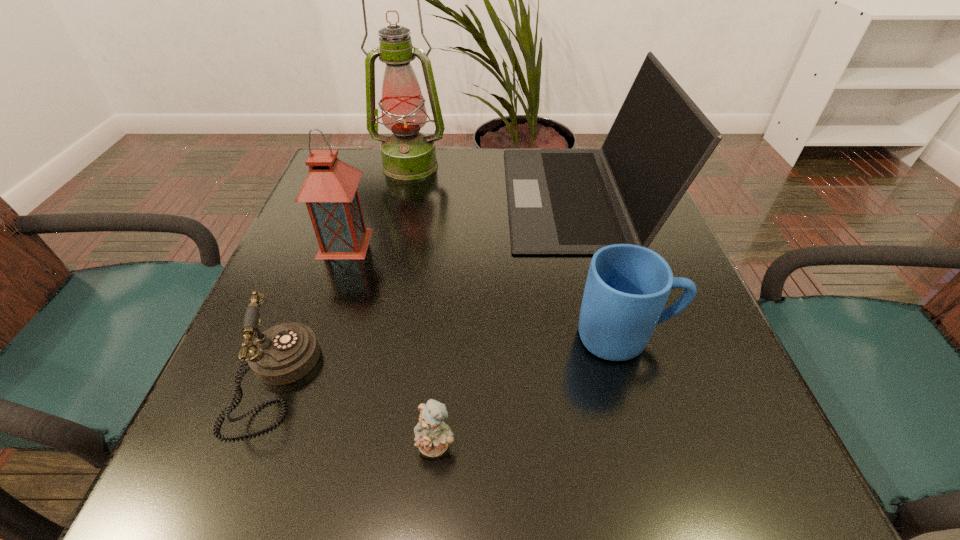
You are a GUI agent. You are given a task and a screenshot of the screen. Output one action in this format:
    pyautogui.click(x=<x>, y=<y>)
    Task: Click on the tallest object
    This screenshot has height=540, width=960.
    Given the screenshot: What is the action you would take?
    pyautogui.click(x=407, y=154)

You are a GUI agent. You are given a task and a screenshot of the screen. Output one action in this format:
    pyautogui.click(x=<x>, y=<y>)
    Task: Click on the laptop
    
    Given the screenshot: What is the action you would take?
    pyautogui.click(x=560, y=201)

Locate an element on the screen. lantern is located at coordinates (330, 192).

Identify the location of the fourth tallest object. The image size is (960, 540). (627, 286).

This screenshot has width=960, height=540. Find the location of `telephone`. telephone is located at coordinates (285, 353).

Locate an element on the screen. The height and width of the screenshot is (540, 960). teddy bear is located at coordinates (432, 435).

Image resolution: width=960 pixels, height=540 pixels. I want to click on vacant space located 0.130m on the right of the oil lamp, so click(x=496, y=165).

Where is `free location located 0.390m on the screen of the laptop`? free location located 0.390m on the screen of the laptop is located at coordinates (344, 196).

What are the coordinates of `blank space located on the screen of the laptop` in the screenshot? It's located at (377, 196).

The height and width of the screenshot is (540, 960). Find the location of `blank space located 0.210m on the screen of the laptop`. blank space located 0.210m on the screen of the laptop is located at coordinates (420, 196).